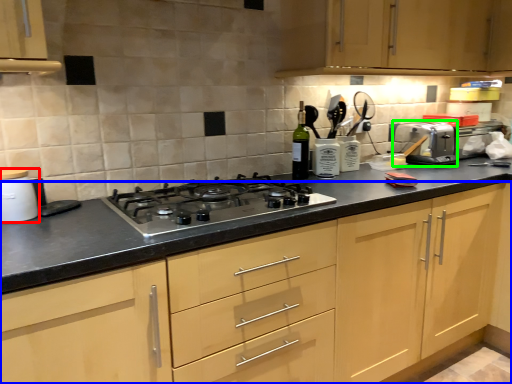
Question: Which object is the closest to the kitchen appliance (highlighted by a red box)? Choose among these: cabinetry (highlighted by a blue box) or toaster (highlighted by a green box).

Choices:
 (A) cabinetry
 (B) toaster

Answer: (A)